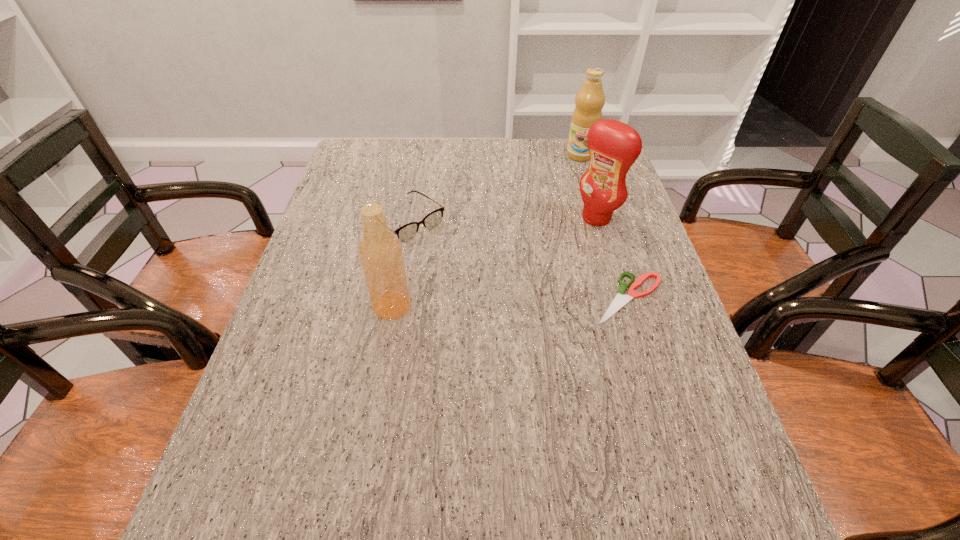
The image size is (960, 540). Find the location of `vacant space on the desktop that is between the beer bottle and the scissors and is positioned on the face of the second shortest object`. vacant space on the desktop that is between the beer bottle and the scissors and is positioned on the face of the second shortest object is located at coordinates (501, 302).

Where is `free space on the desktop that is between the beer bottle and the shortest object and is positioned on the label side of the condiment`? free space on the desktop that is between the beer bottle and the shortest object and is positioned on the label side of the condiment is located at coordinates (483, 303).

In order to click on vacant spot on the desktop that is between the beer bottle and the scissors and is positioned on the label of the farthest object in this screenshot , I will do `click(540, 301)`.